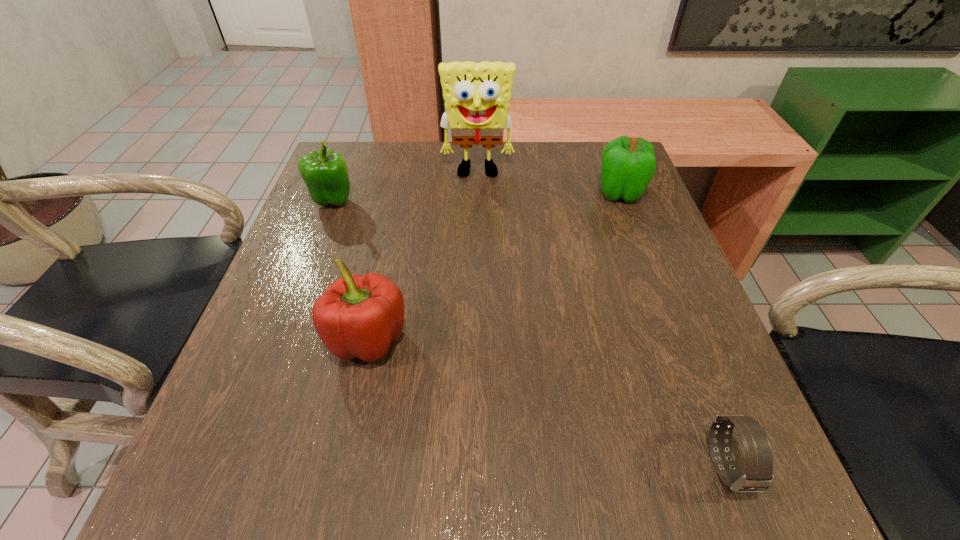
Image resolution: width=960 pixels, height=540 pixels. In order to click on vacant point that satisfies the following two spatial constraints: 1. on the face of the third object from right to left; 2. on the left side of the rightmost bell pepper in this screenshot , I will do `click(477, 193)`.